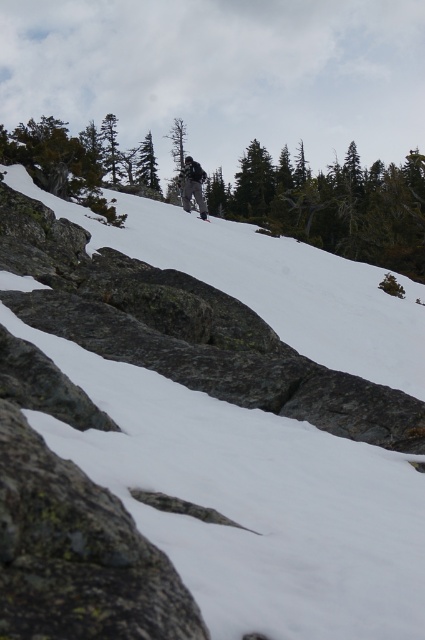
Question: Which point is closer to the camera?

Choices:
 (A) green matte tree at center
 (B) white powdery snow at center
 (C) black matte ski at upper center
 (D) dark gray ski pants at center

Answer: (B)

Question: Observing the image, what is the correct spatial positioning of white powdery snow at center in reference to green leafy tree at upper center?

Choices:
 (A) below
 (B) above

Answer: (A)

Question: Among these objects, which one is nearest to the camera?

Choices:
 (A) black matte ski at upper center
 (B) green leafy tree at upper center

Answer: (B)

Question: Based on their relative distances, which object is nearer to the black matte ski at center?

Choices:
 (A) black matte ski at upper center
 (B) green matte tree at center
 (C) white powdery snow at center
 (D) green leafy tree at upper center

Answer: (A)

Question: Does green matte tree at center have a larger size compared to black matte ski at upper center?

Choices:
 (A) yes
 (B) no

Answer: (A)

Question: Does green matte tree at center appear on the right side of black matte ski at upper center?

Choices:
 (A) no
 (B) yes

Answer: (A)